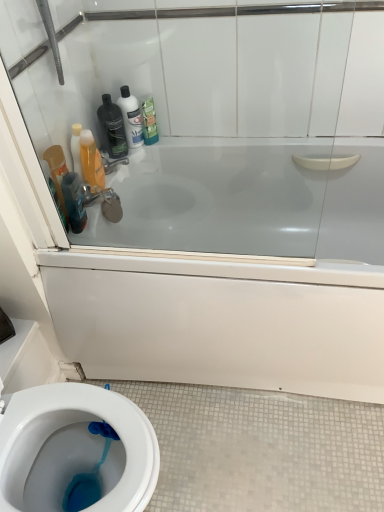
Question: Could you tell me if matte black bottle at upper left is facing transparent glass door at upper center?

Choices:
 (A) yes
 (B) no

Answer: (A)

Question: From a real-world perspective, is matte black bottle at upper left under transparent glass door at upper center?

Choices:
 (A) no
 (B) yes

Answer: (B)

Question: Is matte black bottle at upper left wider than transparent glass door at upper center?

Choices:
 (A) no
 (B) yes

Answer: (B)

Question: Does matte black bottle at upper left come in front of transparent glass door at upper center?

Choices:
 (A) yes
 (B) no

Answer: (B)

Question: Are matte black bottle at upper left and transparent glass door at upper center far apart?

Choices:
 (A) yes
 (B) no

Answer: (B)

Question: Is matte black bottle at upper left to the left or to the right of transparent glass door at upper center in the image?

Choices:
 (A) right
 (B) left

Answer: (B)

Question: Does point 109,132 appear closer or farther from the camera than point 44,95?

Choices:
 (A) closer
 (B) farther

Answer: (B)

Question: In terms of size, does matte black bottle at upper left appear bigger or smaller than transparent glass door at upper center?

Choices:
 (A) small
 (B) big

Answer: (A)

Question: From a real-world perspective, relative to transparent glass door at upper center, is matte black bottle at upper left vertically above or below?

Choices:
 (A) above
 (B) below

Answer: (B)

Question: Visually, is white glossy bathtub at upper center positioned to the left or to the right of matte silver faucet at upper left?

Choices:
 (A) right
 (B) left

Answer: (A)

Question: From the image's perspective, relative to matte silver faucet at upper left, is white glossy bathtub at upper center above or below?

Choices:
 (A) below
 (B) above

Answer: (A)

Question: Is white glossy bathtub at upper center spatially inside matte silver faucet at upper left, or outside of it?

Choices:
 (A) outside
 (B) inside

Answer: (A)

Question: Considering their positions, is white glossy bathtub at upper center located in front of or behind matte silver faucet at upper left?

Choices:
 (A) front
 (B) behind

Answer: (A)

Question: In terms of size, does translucent orange bottle at upper left, which appears as the 3th cleaning product when viewed from the right, appear bigger or smaller than matte silver faucet at upper left?

Choices:
 (A) big
 (B) small

Answer: (A)

Question: Does point (97, 164) appear closer or farther from the camera than point (107, 157)?

Choices:
 (A) farther
 (B) closer

Answer: (B)